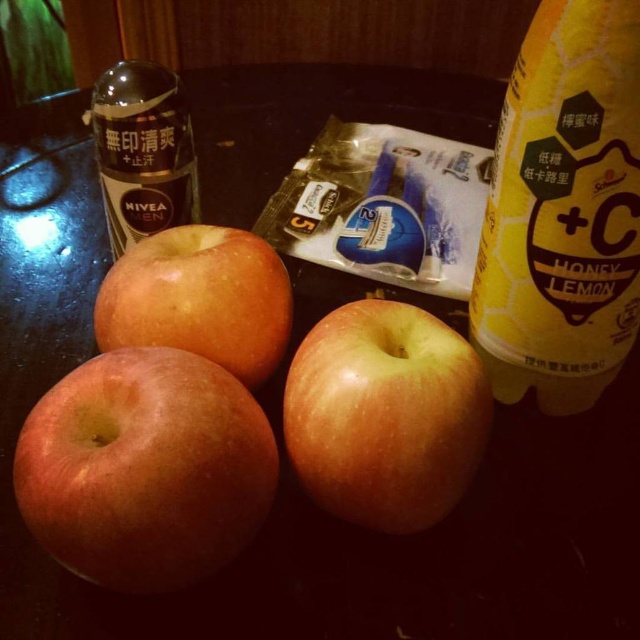
You are holding a smartphone and want to take a photo of the scene. The point you want to focus on is at coordinate point (193,509). Based on the distance of this point from the camera, will the focus be sharp if the depth of field allows for objects within 15 inches to be in focus?

The distance of point (193,509) from the camera is 16.21 inches, which is beyond the 15 inches depth of field range. Therefore, the focus will not be sharp.

You are trying to place a ruler between the yellow matte apple at center and the shiny golden apple at center. How far apart are they?

The yellow matte apple at center and the shiny golden apple at center are 6.21 inches apart from each other.

You are arranging fruits on a table and see the smooth golden apple at lower left and the shiny golden apple at center. Which apple is positioned lower on the table?

The smooth golden apple at lower left is positioned lower than the shiny golden apple at center.